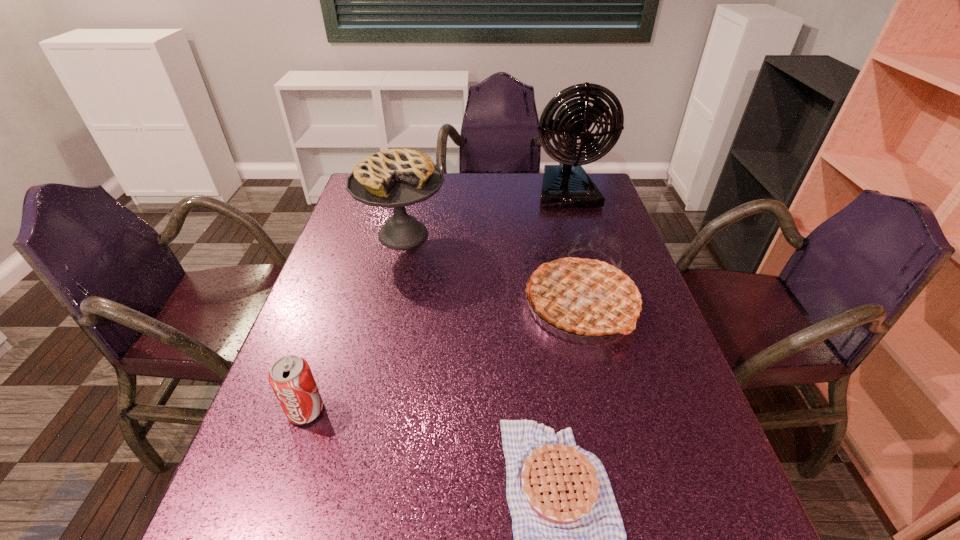
Locate an element on the screen. free point between the farthest pie and the third farthest object is located at coordinates (492, 270).

At what (x,y) coordinates should I click in order to perform the action: click on empty space that is in between the farthest pie and the fourth tallest object. Please return your answer as a coordinate pair (x, y). The image size is (960, 540). Looking at the image, I should click on (354, 322).

I want to click on free area in between the fan and the second shortest object, so (x=436, y=301).

I want to click on unoccupied position between the fan and the leftmost pie, so click(485, 213).

Choose which object is the nearest neighbor to the tallest object. Please provide its 2D coordinates. Your answer should be formatted as a tuple, i.e. [(x, y)], where the tuple contains the x and y coordinates of a point satisfying the conditions above.

[(395, 178)]

You are a GUI agent. You are given a task and a screenshot of the screen. Output one action in this format:
    pyautogui.click(x=<x>, y=<y>)
    Task: Click on the object that is the second closest one to the fourth tallest object
    The width and height of the screenshot is (960, 540).
    Given the screenshot: What is the action you would take?
    pyautogui.click(x=395, y=178)

Identify the location of pie that is the closest one to the second farthest pie. This screenshot has height=540, width=960. (569, 539).

The image size is (960, 540). I want to click on pie that is the second nearest to the second farthest pie, so click(x=395, y=178).

Locate an element on the screen. This screenshot has height=540, width=960. free space that satisfies the following two spatial constraints: 1. on the cut side of the farthest pie; 2. on the right side of the third nearest object is located at coordinates (387, 306).

Where is `free spot that satisfies the following two spatial constraints: 1. on the cut side of the leftmost pie; 2. on the right side of the third farthest object`? This screenshot has width=960, height=540. free spot that satisfies the following two spatial constraints: 1. on the cut side of the leftmost pie; 2. on the right side of the third farthest object is located at coordinates (387, 306).